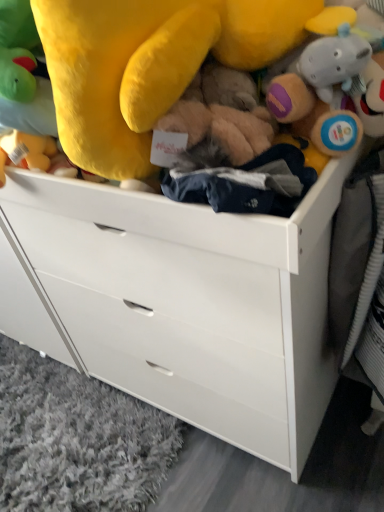
Question: Is white matte chest of drawers at center shorter than soft plush toys at upper center?

Choices:
 (A) yes
 (B) no

Answer: (B)

Question: Is the position of white matte chest of drawers at center more distant than that of soft plush toys at upper center?

Choices:
 (A) no
 (B) yes

Answer: (B)

Question: From the image's perspective, would you say white matte chest of drawers at center is positioned over soft plush toys at upper center?

Choices:
 (A) no
 (B) yes

Answer: (A)

Question: From a real-world perspective, is white matte chest of drawers at center located beneath soft plush toys at upper center?

Choices:
 (A) no
 (B) yes

Answer: (B)

Question: Is white matte chest of drawers at center outside soft plush toys at upper center?

Choices:
 (A) yes
 (B) no

Answer: (A)

Question: Is the surface of white matte chest of drawers at center in direct contact with soft plush toys at upper center?

Choices:
 (A) yes
 (B) no

Answer: (B)

Question: Is soft plush toys at upper center located outside white matte chest of drawers at center?

Choices:
 (A) no
 (B) yes

Answer: (B)

Question: From a real-world perspective, is soft plush toys at upper center located beneath white matte chest of drawers at center?

Choices:
 (A) yes
 (B) no

Answer: (B)

Question: Considering the relative sizes of soft plush toys at upper center and white matte chest of drawers at center in the image provided, is soft plush toys at upper center bigger than white matte chest of drawers at center?

Choices:
 (A) yes
 (B) no

Answer: (B)

Question: Is soft plush toys at upper center at the left side of white matte chest of drawers at center?

Choices:
 (A) yes
 (B) no

Answer: (A)

Question: From the image's perspective, is soft plush toys at upper center located above white matte chest of drawers at center?

Choices:
 (A) yes
 (B) no

Answer: (A)

Question: Is white matte chest of drawers at center a part of soft plush toys at upper center?

Choices:
 (A) yes
 (B) no

Answer: (B)

Question: Does point (33, 7) appear closer or farther from the camera than point (221, 297)?

Choices:
 (A) farther
 (B) closer

Answer: (B)